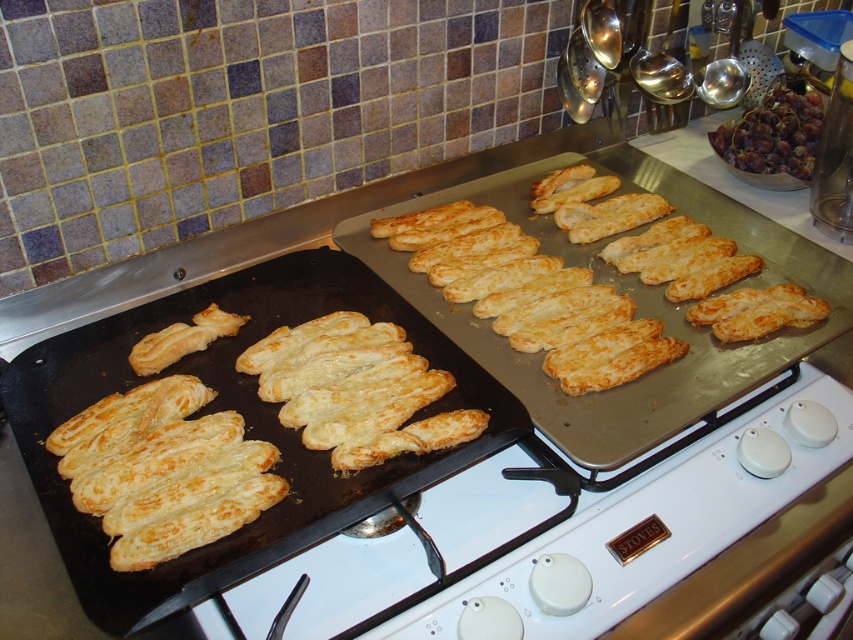
Is white glossy gas stove at center thinner than golden flaky pastry at center?

No.

This screenshot has width=853, height=640. What do you see at coordinates (657, 515) in the screenshot? I see `white glossy gas stove at center` at bounding box center [657, 515].

You are a GUI agent. You are given a task and a screenshot of the screen. Output one action in this format:
    pyautogui.click(x=<x>, y=<y>)
    Task: Click on the white glossy gas stove at center
    
    Given the screenshot: What is the action you would take?
    pyautogui.click(x=657, y=515)

Which is behind, point (457, 403) or point (152, 346)?

Point (152, 346)

Can you confirm if golden brown puff pastry at left is taller than golden flaky pastry at center?

Correct, golden brown puff pastry at left is much taller as golden flaky pastry at center.

Image resolution: width=853 pixels, height=640 pixels. In order to click on golden brown puff pastry at left in this screenshot , I will do `click(244, 426)`.

This screenshot has width=853, height=640. I want to click on golden brown puff pastry at left, so click(x=244, y=426).

Measure the distance between golden brown puff pastry at left and camera.

golden brown puff pastry at left and camera are 26.58 inches apart from each other.

Is golden brown puff pastry at left positioned at the back of shiny metallic grapes at upper right?

No, golden brown puff pastry at left is in front of shiny metallic grapes at upper right.

Image resolution: width=853 pixels, height=640 pixels. Identify the location of golden brown puff pastry at left. (244, 426).

Where is `golden brown puff pastry at left`? The width and height of the screenshot is (853, 640). golden brown puff pastry at left is located at coordinates (244, 426).